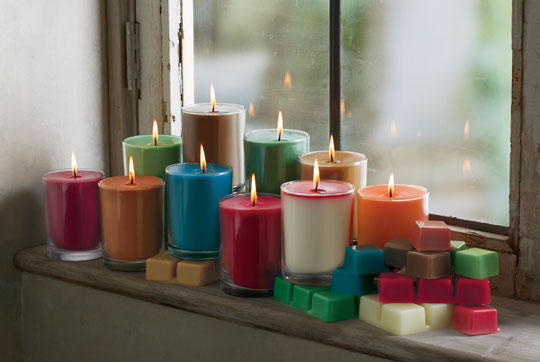
At what (x,y) coordinates should I click in order to perform the action: click on reflection of candle flames in the window. Please return your answer as a coordinate pair (x, y). Looking at the image, I should click on (249, 111), (287, 80), (342, 108), (392, 129), (465, 165), (465, 129), (418, 133).